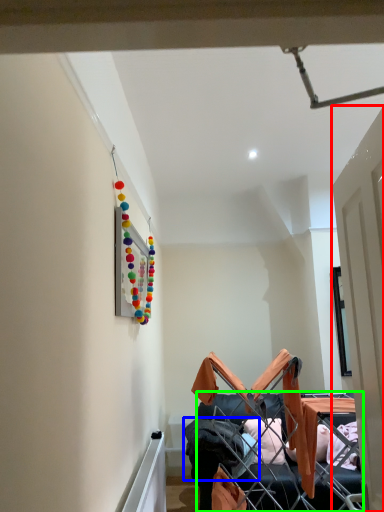
Question: Which object is the closest to the door (highlighted by a red box)? Choose among these: clothing (highlighted by a blue box) or furniture (highlighted by a green box).

Choices:
 (A) clothing
 (B) furniture

Answer: (B)